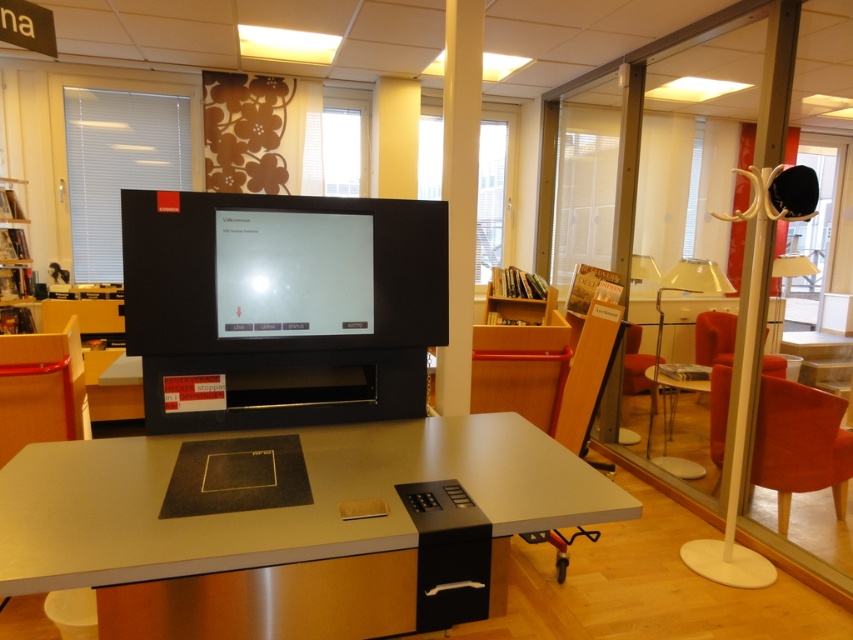
You are a person with a height of 5 feet 6 inches. You are standing in front of the black matte computer monitor at center. Can you comfortably reach the camera located 5.85 feet away from the monitor?

The camera is 5.85 feet away from the black matte computer monitor at center. Since the person is 5 feet 6 inches tall, which is about 5.5 feet, the distance to the camera is slightly farther than their height. However, reaching 5.85 feet might be challenging for most people without assistance. It is recommended to move closer or use a tool to reach the camera.